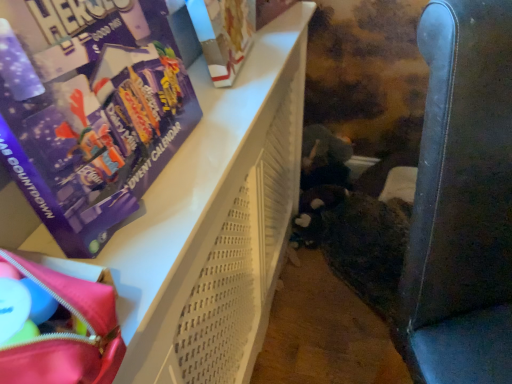
Question: From the image's perspective, is white perforated plastic basket at upper left above matte pink fabric bag at lower left?

Choices:
 (A) no
 (B) yes

Answer: (A)

Question: Does white perforated plastic basket at upper left have a lesser height compared to matte pink fabric bag at lower left?

Choices:
 (A) no
 (B) yes

Answer: (A)

Question: Does white perforated plastic basket at upper left turn towards matte pink fabric bag at lower left?

Choices:
 (A) yes
 (B) no

Answer: (B)

Question: Considering the relative sizes of white perforated plastic basket at upper left and matte pink fabric bag at lower left in the image provided, is white perforated plastic basket at upper left smaller than matte pink fabric bag at lower left?

Choices:
 (A) no
 (B) yes

Answer: (A)

Question: Is white perforated plastic basket at upper left completely or partially outside of matte pink fabric bag at lower left?

Choices:
 (A) no
 (B) yes

Answer: (B)

Question: Looking at the image, does matte pink fabric bag at lower left seem bigger or smaller compared to leather-like dark blue armchair at right?

Choices:
 (A) big
 (B) small

Answer: (B)

Question: From a real-world perspective, is matte pink fabric bag at lower left positioned above or below leather-like dark blue armchair at right?

Choices:
 (A) above
 (B) below

Answer: (A)

Question: Is point (55, 283) positioned closer to the camera than point (458, 54)?

Choices:
 (A) closer
 (B) farther

Answer: (B)

Question: Considering the relative positions of matte pink fabric bag at lower left and leather-like dark blue armchair at right in the image provided, is matte pink fabric bag at lower left to the left or to the right of leather-like dark blue armchair at right?

Choices:
 (A) right
 (B) left

Answer: (B)

Question: In terms of size, does purple cardboard advent calendar at upper left appear bigger or smaller than white perforated plastic basket at upper left?

Choices:
 (A) big
 (B) small

Answer: (B)

Question: From a real-world perspective, is purple cardboard advent calendar at upper left physically located above or below white perforated plastic basket at upper left?

Choices:
 (A) above
 (B) below

Answer: (A)

Question: Is purple cardboard advent calendar at upper left inside the boundaries of white perforated plastic basket at upper left, or outside?

Choices:
 (A) outside
 (B) inside

Answer: (A)

Question: Looking at their shapes, would you say purple cardboard advent calendar at upper left is wider or thinner than white perforated plastic basket at upper left?

Choices:
 (A) thin
 (B) wide

Answer: (A)

Question: Is purple cardboard advent calendar at upper left inside or outside of leather-like dark blue armchair at right?

Choices:
 (A) inside
 (B) outside

Answer: (B)

Question: In the image, is purple cardboard advent calendar at upper left positioned in front of or behind leather-like dark blue armchair at right?

Choices:
 (A) front
 (B) behind

Answer: (A)